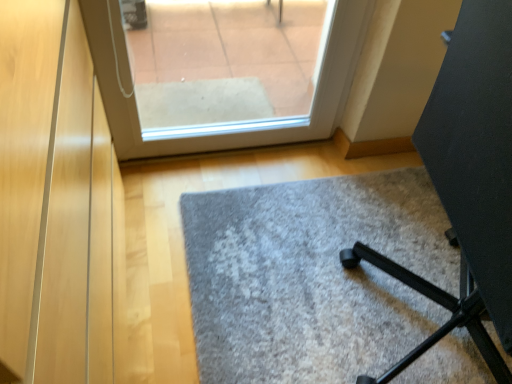
Question: Is black matte tripod at lower right in front of or behind gray carpet at center in the image?

Choices:
 (A) front
 (B) behind

Answer: (A)

Question: Is black matte tripod at lower right bigger or smaller than gray carpet at center?

Choices:
 (A) big
 (B) small

Answer: (A)

Question: Do you think black matte tripod at lower right is within gray carpet at center, or outside of it?

Choices:
 (A) outside
 (B) inside

Answer: (A)

Question: Is gray carpet at center taller or shorter than black matte tripod at lower right?

Choices:
 (A) short
 (B) tall

Answer: (A)

Question: From a real-world perspective, relative to black matte tripod at lower right, is gray carpet at center vertically above or below?

Choices:
 (A) above
 (B) below

Answer: (B)

Question: Does point (264, 258) appear closer or farther from the camera than point (486, 74)?

Choices:
 (A) farther
 (B) closer

Answer: (A)

Question: Would you say gray carpet at center is inside or outside black matte tripod at lower right?

Choices:
 (A) inside
 (B) outside

Answer: (B)